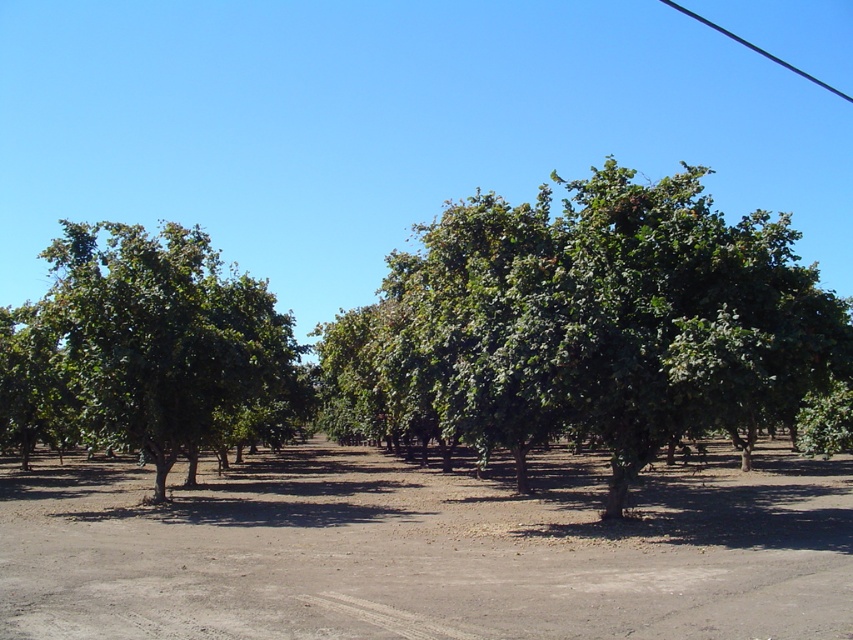
Is green leafy tree at center to the left of green leafy tree at left from the viewer's perspective?

In fact, green leafy tree at center is to the right of green leafy tree at left.

Consider the image. Between green leafy tree at center and green leafy tree at left, which one is positioned higher?

Positioned higher is green leafy tree at center.

Which is in front, point (843, 339) or point (219, 364)?

Point (843, 339) is in front.

Find the location of a particular element. green leafy tree at center is located at coordinates (587, 324).

Measure the distance between brown dirt field at center and green leafy tree at left.

brown dirt field at center is 6.97 meters from green leafy tree at left.

From the picture: Can you confirm if brown dirt field at center is positioned below green leafy tree at left?

Yes, brown dirt field at center is below green leafy tree at left.

Who is more forward, (155, 513) or (149, 291)?

Point (155, 513) is more forward.

Where is `brown dirt field at center`? brown dirt field at center is located at coordinates (425, 548).

Is brown dirt field at center to the right of green leafy tree at center from the viewer's perspective?

In fact, brown dirt field at center is to the left of green leafy tree at center.

Does brown dirt field at center have a lesser height compared to green leafy tree at center?

Correct, brown dirt field at center is not as tall as green leafy tree at center.

Identify the location of brown dirt field at center. (425, 548).